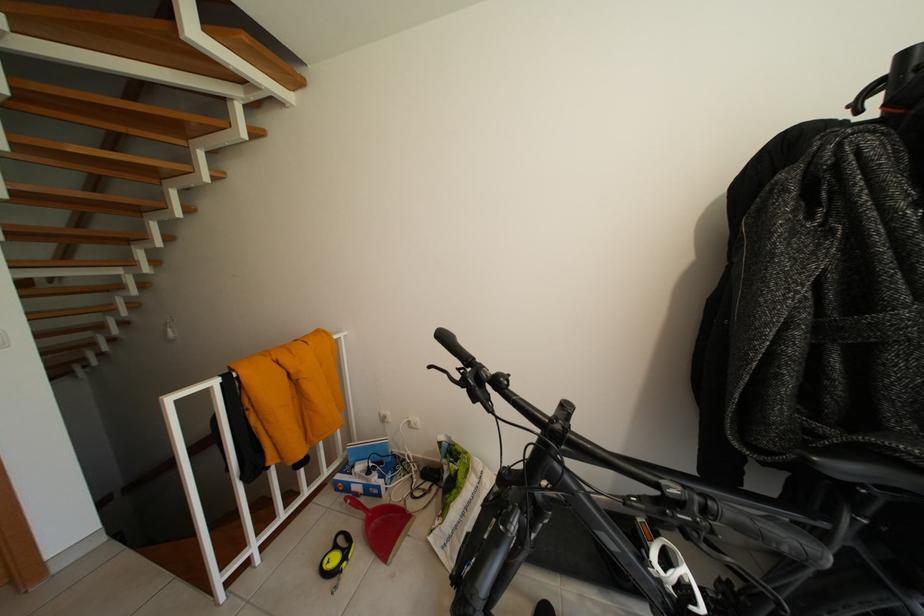
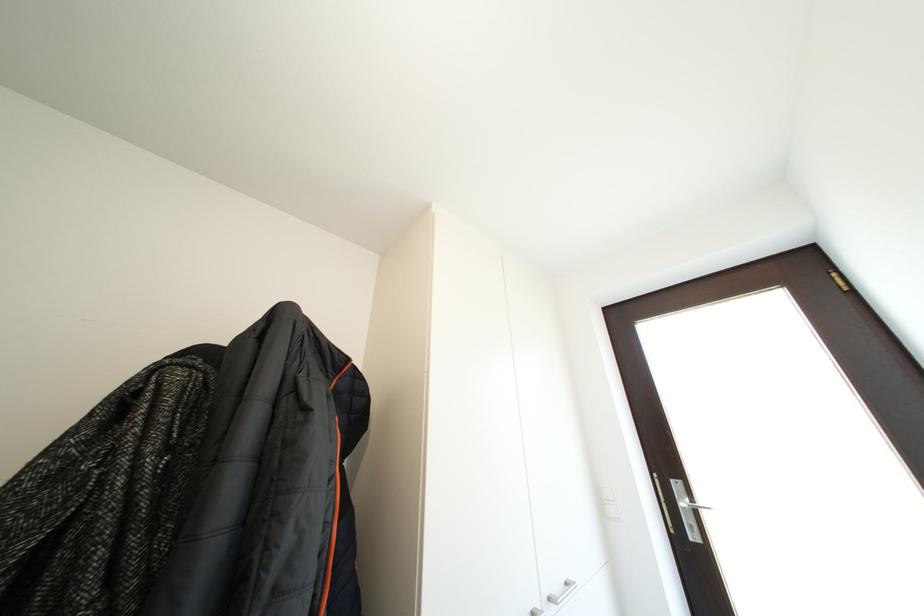
How did the camera likely rotate?

The rotation direction of the camera is right-up.